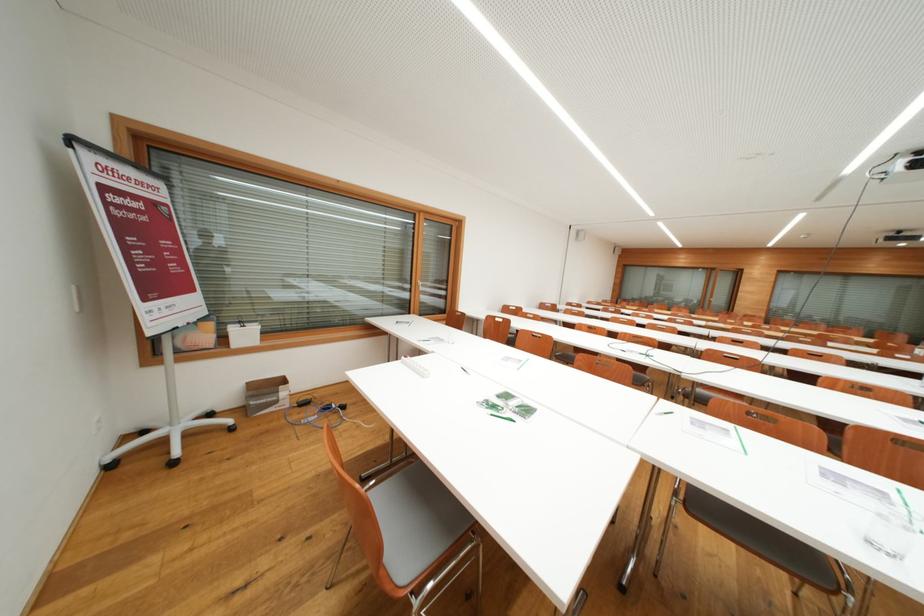
Where is `grey chair sitting surface`? grey chair sitting surface is located at coordinates (417, 507).